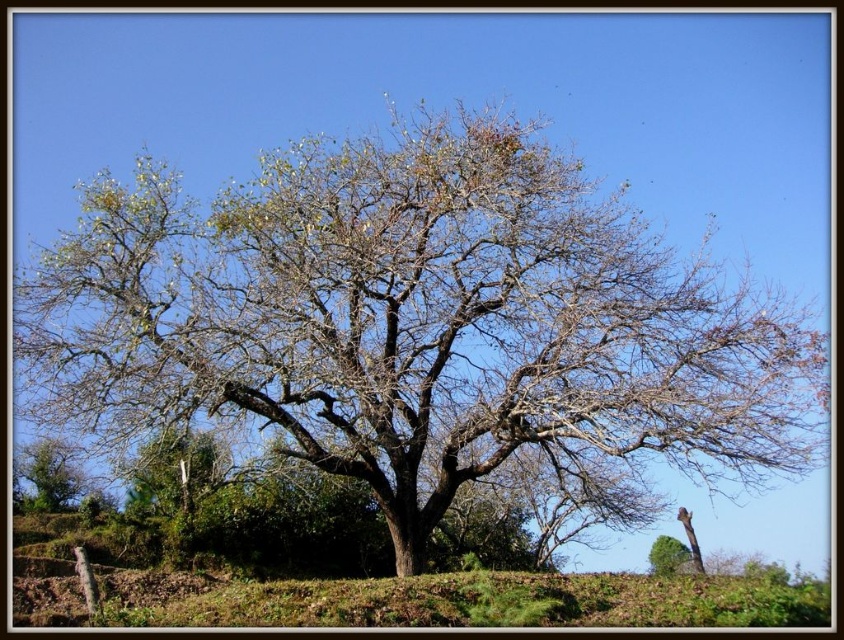
Can you confirm if green leafy tree at lower left is bigger than green leafy tree at lower right?

Yes.

Who is more forward, (25, 448) or (655, 573)?

Point (655, 573) is more forward.

At what (x,y) coordinates should I click in order to perform the action: click on green leafy tree at lower left. Please return your answer as a coordinate pair (x, y). This screenshot has height=640, width=844. Looking at the image, I should click on (47, 476).

This screenshot has height=640, width=844. Identify the location of brown soil at center. (460, 600).

Consider the image. Between brown soil at center and green leafy tree at lower left, which one is positioned lower?

Positioned lower is brown soil at center.

Is point (20, 573) positioned behind point (36, 467)?

No, (20, 573) is closer to viewer.

Image resolution: width=844 pixels, height=640 pixels. In order to click on brown soil at center in this screenshot , I will do `click(460, 600)`.

The width and height of the screenshot is (844, 640). What do you see at coordinates (460, 600) in the screenshot? I see `brown soil at center` at bounding box center [460, 600].

Which is more to the right, brown soil at center or green leafy tree at lower right?

green leafy tree at lower right

Does point (63, 616) come closer to viewer compared to point (683, 557)?

Yes, point (63, 616) is in front of point (683, 557).

This screenshot has width=844, height=640. I want to click on brown soil at center, so click(x=460, y=600).